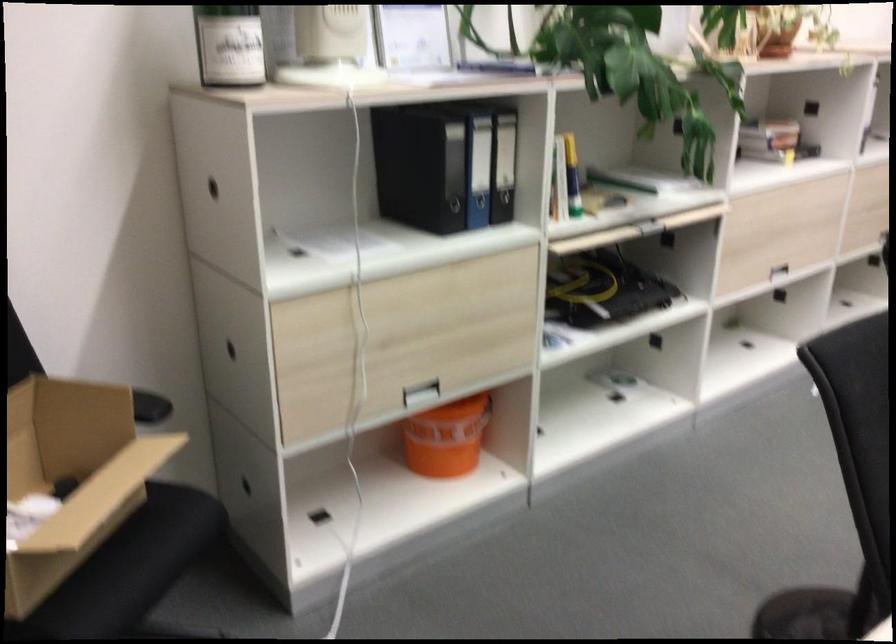
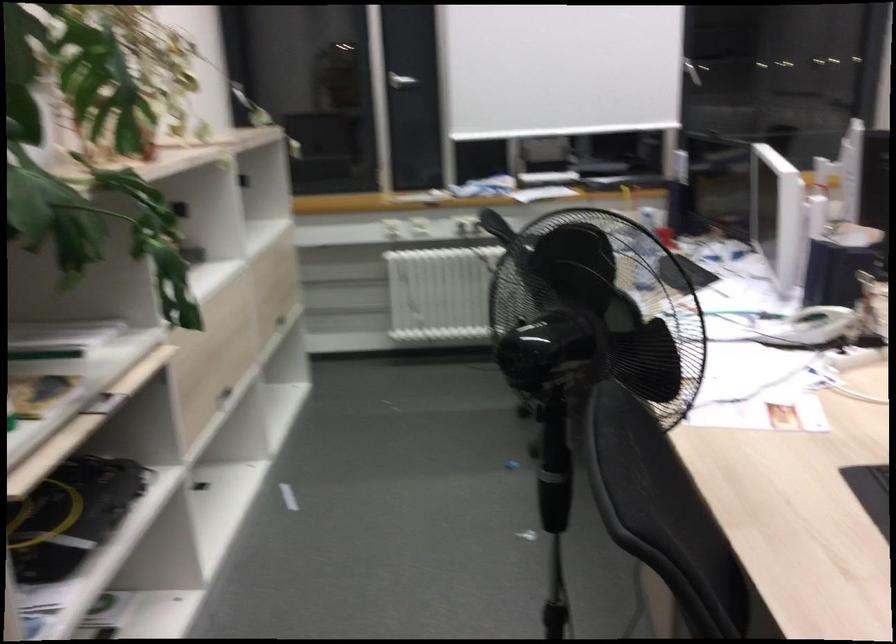
Find the pixel in the second image that matches (746,261) in the first image.

(211, 395)